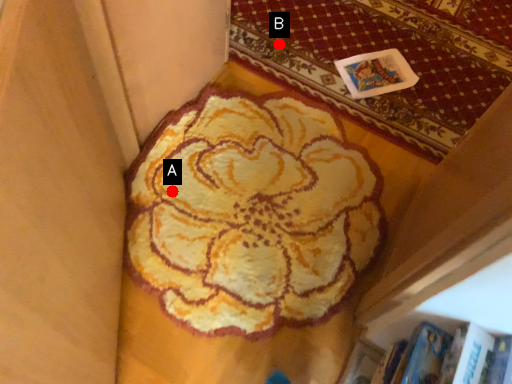
Question: Two points are circled on the image, labeled by A and B beside each circle. Which point is further to the camera?

Choices:
 (A) A is further
 (B) B is further

Answer: (B)